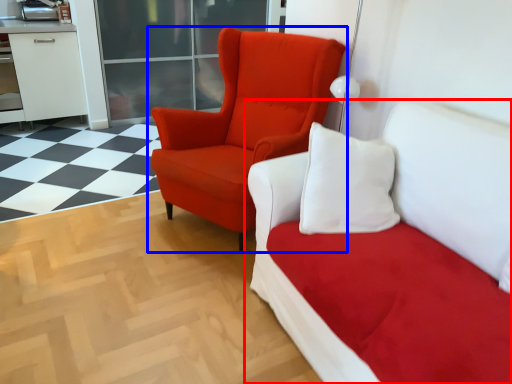
Question: Which object is further to the camera taking this photo, studio couch (highlighted by a red box) or chair (highlighted by a blue box)?

Choices:
 (A) studio couch
 (B) chair

Answer: (B)